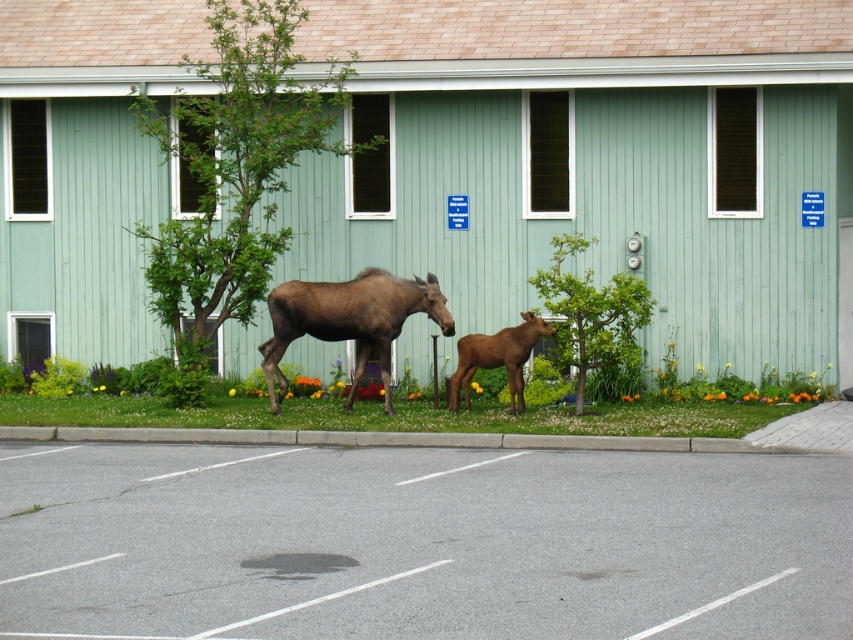
You are a delivery driver who needs to park your 15 feet long truck in the gray asphalt parking lot at lower center. The parking space is marked with a white line. The distance between the adult moose on the left and the juvenile moose on the right is 29.73 feet. Can your truck fit in the parking space?

The parking space between the adult moose on the left and the juvenile moose on the right is 29.73 feet. Since your truck is 15 feet long, it can easily fit within the parking space as the available space is more than double the length of your truck.

You are a wildlife photographer trying to capture a photo of both the brown matte moose at center and the brown furry calf at center. Since you want to emphasize their size difference, which moose should you position closer to the camera to achieve this effect?

To emphasize the size difference between the brown matte moose at center and the brown furry calf at center, you should position the brown furry calf at center closer to the camera. Since the brown matte moose at center is larger, placing the smaller calf closer can create a visual comparison where both appear similar in size in the frame, thereby highlighting their actual size difference in reality.

You are standing at the point labeled point (x=421, y=541). You want to walk to the building with light green exterior and brick roof. Which direction should you go?

The point (x=421, y=541) is on the gray asphalt parking lot at lower center. Since the building with light green exterior and brick roof is adjacent to the parking lot, you should walk towards the building which is located above the parking lot in the scene.